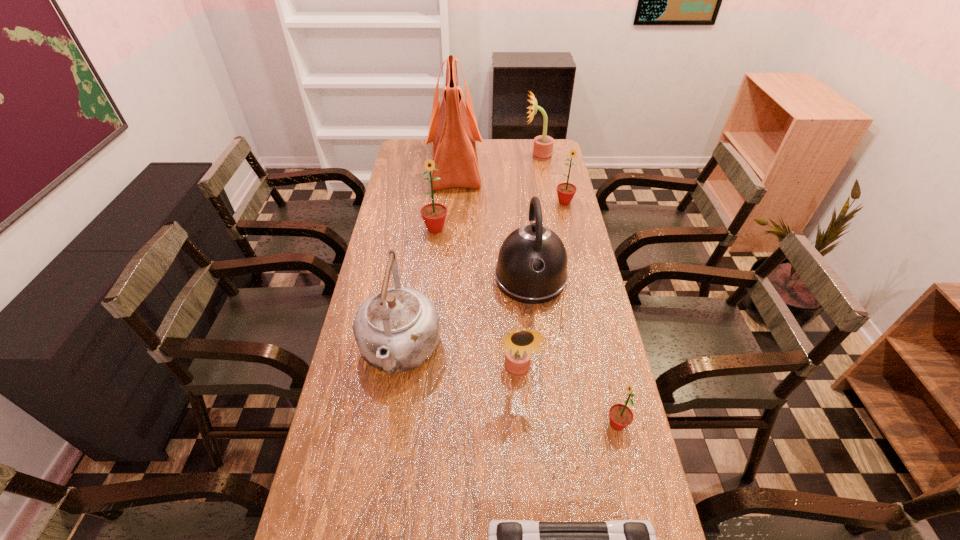
The width and height of the screenshot is (960, 540). In order to click on blank area located on the spout of the fifth nearest object in this screenshot , I will do `click(537, 332)`.

Locate an element on the screen. free space located 0.080m at the spout of the left kettle is located at coordinates (388, 426).

You are a GUI agent. You are given a task and a screenshot of the screen. Output one action in this format:
    pyautogui.click(x=<x>, y=<y>)
    Task: Click on the vacant space located on the face of the third farthest object
    Image resolution: width=960 pixels, height=540 pixels.
    Given the screenshot: What is the action you would take?
    pyautogui.click(x=580, y=269)

Locate an element on the screen. vacant space located 0.200m on the face of the nearer yellow sunflower is located at coordinates (524, 463).

This screenshot has width=960, height=540. What are the coordinates of `free space located 0.330m on the face of the shortest sunflower` in the screenshot? It's located at (473, 424).

This screenshot has width=960, height=540. In order to click on vacant region located on the face of the shortest sunflower in this screenshot , I will do `click(509, 424)`.

Locate an element on the screen. Image resolution: width=960 pixels, height=540 pixels. free space located 0.370m on the face of the shortest sunflower is located at coordinates (457, 424).

Find the location of a particular element. Image resolution: width=960 pixels, height=540 pixels. shopping bag positioned at the far edge is located at coordinates (453, 131).

At what (x,y) coordinates should I click in order to perform the action: click on sunflower positioned at the far edge. Please return your answer as a coordinate pair (x, y). Image resolution: width=960 pixels, height=540 pixels. Looking at the image, I should click on (543, 145).

Where is `shopping bag that is at the left edge`? The image size is (960, 540). shopping bag that is at the left edge is located at coordinates pyautogui.click(x=453, y=131).